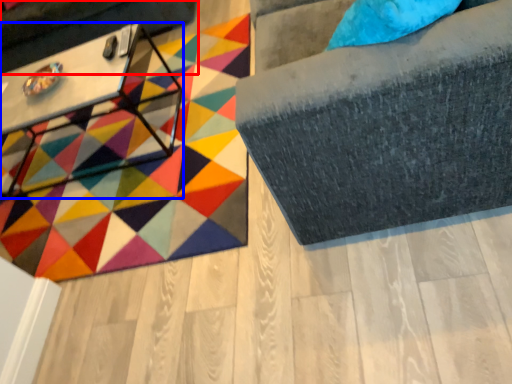
Question: Which of the following is the closest to the observer, swivel chair (highlighted by a red box) or table (highlighted by a blue box)?

Choices:
 (A) swivel chair
 (B) table

Answer: (B)